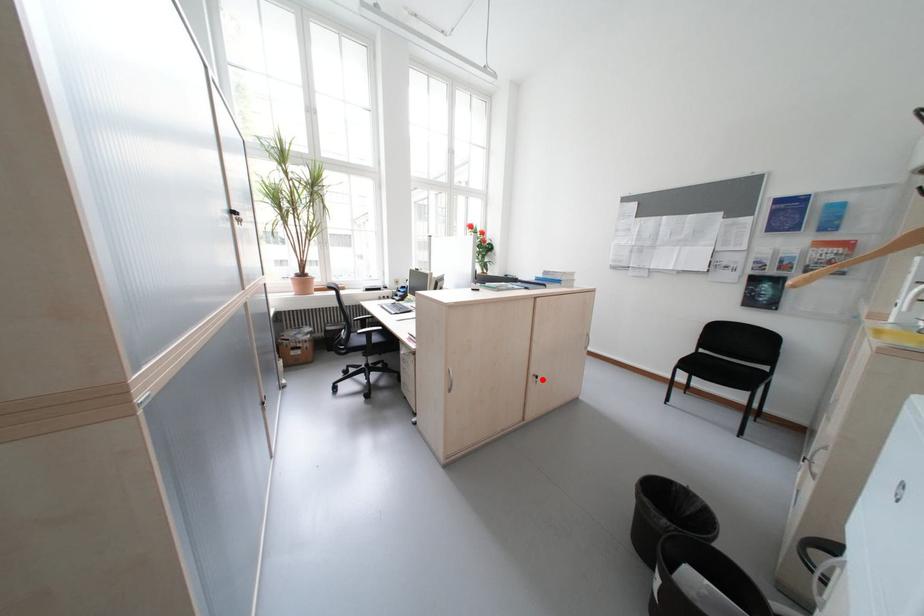
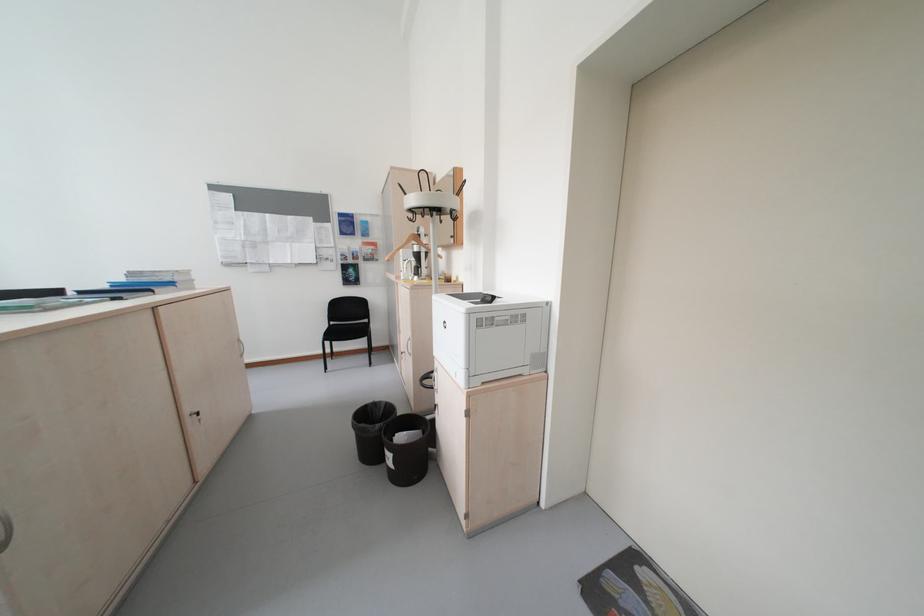
The point at the highlighted location is marked in the first image. Where is the corresponding point in the second image?

(200, 421)